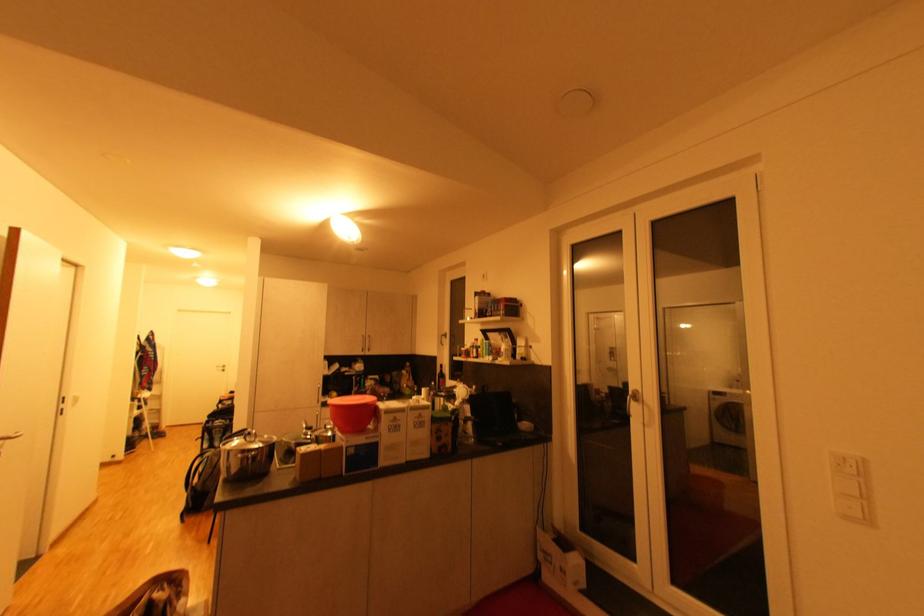
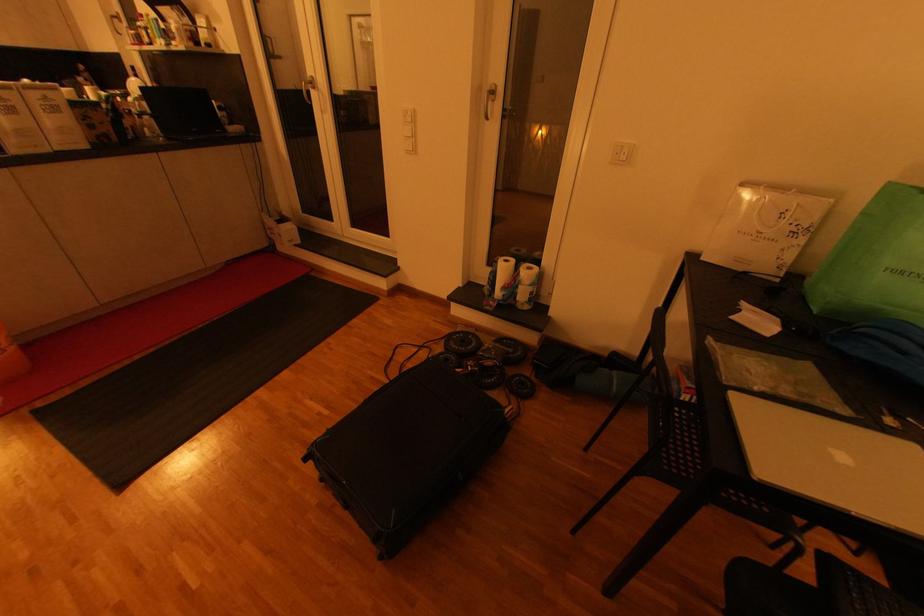
In the second image, find the point that corresponds to point 854,517 in the first image.

(412, 153)